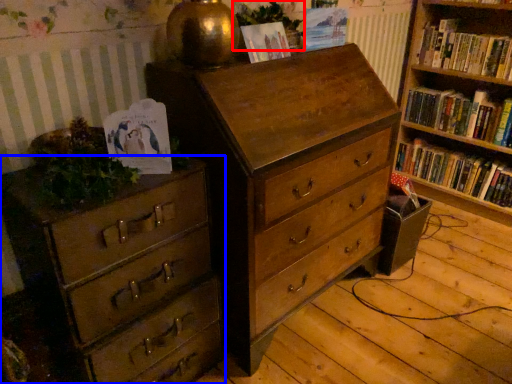
Question: Which point is further to the camera, plant (highlighted by a red box) or chest of drawers (highlighted by a blue box)?

Choices:
 (A) plant
 (B) chest of drawers

Answer: (A)